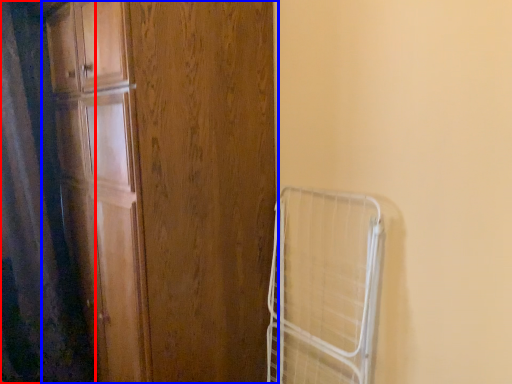
Question: Which object appears closest to the camera in this image, shower curtain (highlighted by a red box) or door (highlighted by a blue box)?

Choices:
 (A) shower curtain
 (B) door

Answer: (B)